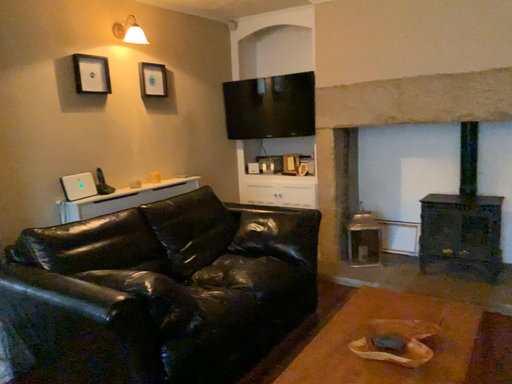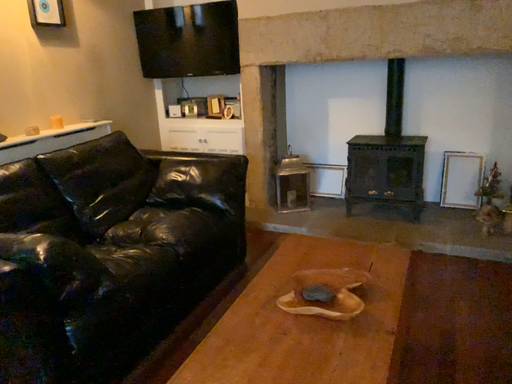
Question: How did the camera likely rotate when shooting the video?

Choices:
 (A) rotated right
 (B) rotated left

Answer: (A)